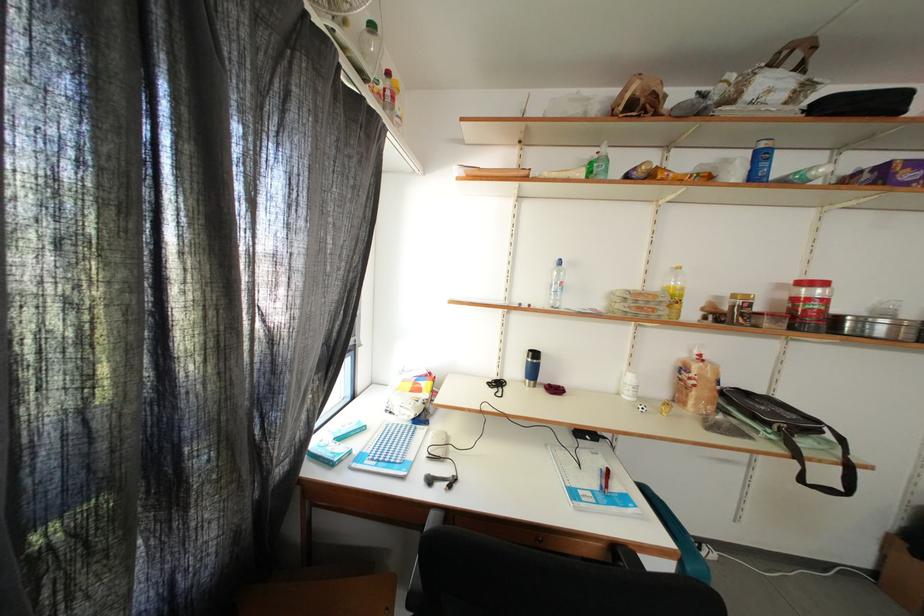
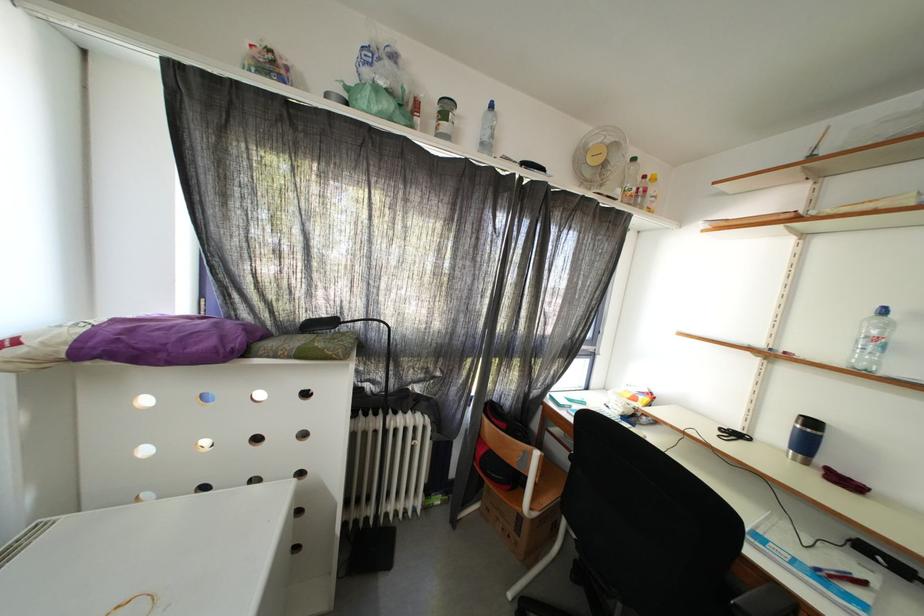
Find the pixel in the second image that matches (610,493) in the first image.

(827, 573)